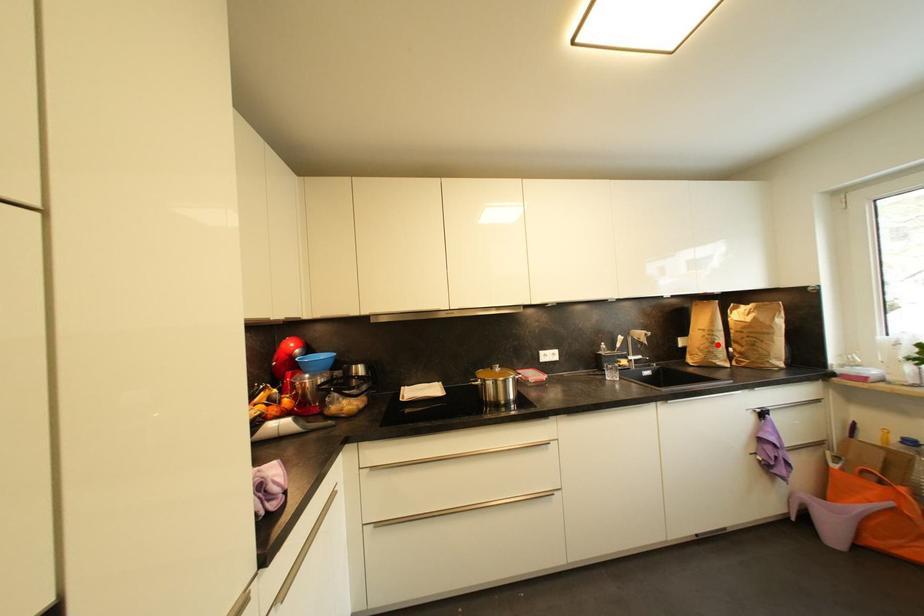
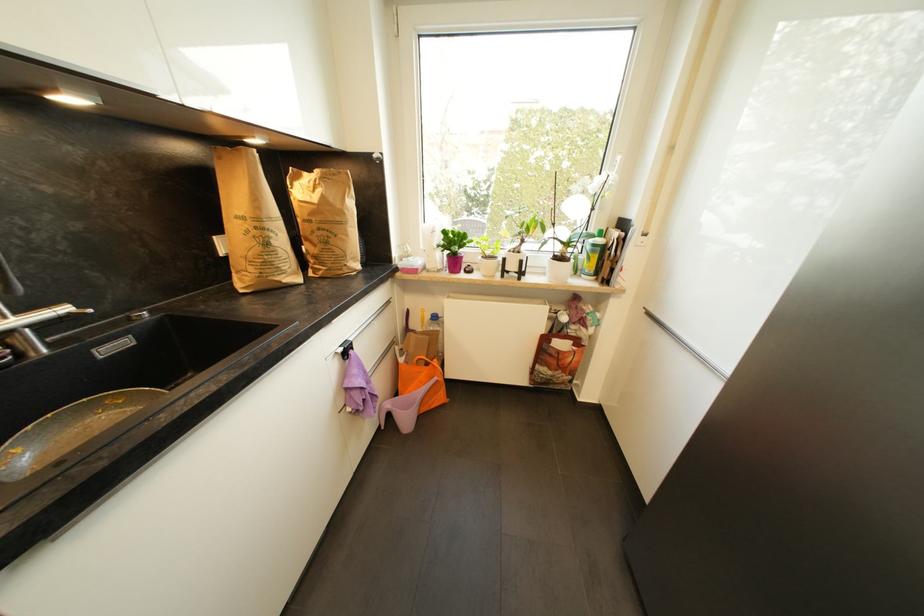
Question: I am providing you with two images of the same scene from different viewpoints. A red point is marked on the first image. Can you still see the location of the red point in image 2?

Choices:
 (A) Yes
 (B) No

Answer: (A)